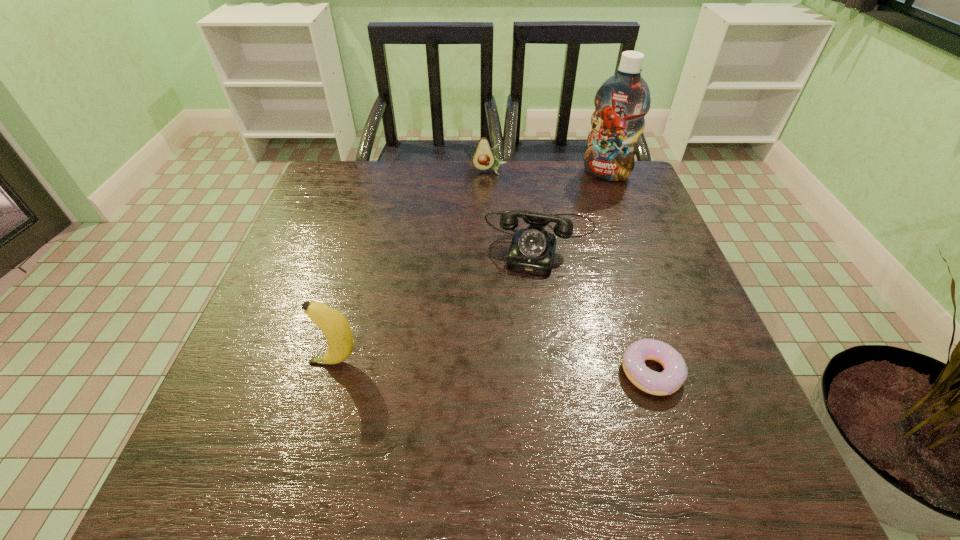
This screenshot has width=960, height=540. In the image, there is a desktop. Identify the location of blank space at the near left corner. (215, 420).

In order to click on vacant area between the avocado and the shortest object in this screenshot , I will do coord(570,271).

This screenshot has width=960, height=540. In order to click on free spot between the leftmost object and the third farthest object in this screenshot , I will do `click(439, 302)`.

Find the location of a particular element. This screenshot has width=960, height=540. vacant point located between the banana and the tallest object is located at coordinates (470, 268).

At what (x,y) coordinates should I click in order to perform the action: click on free space between the third nearest object and the banana. Please return your answer as a coordinate pair (x, y). Image resolution: width=960 pixels, height=540 pixels. Looking at the image, I should click on (439, 302).

Find the location of a particular element. The image size is (960, 540). vacant space in between the avocado and the doughnut is located at coordinates (570, 271).

Locate an element on the screen. The image size is (960, 540). free space between the avocado and the shortest object is located at coordinates (570, 271).

Identify the location of free area in between the fourth shortest object and the telephone. (439, 302).

Where is `vacant area that lies between the tallest object and the third farthest object`? The image size is (960, 540). vacant area that lies between the tallest object and the third farthest object is located at coordinates (574, 208).

Image resolution: width=960 pixels, height=540 pixels. I want to click on vacant space that is in between the second tallest object and the avocado, so click(x=413, y=266).